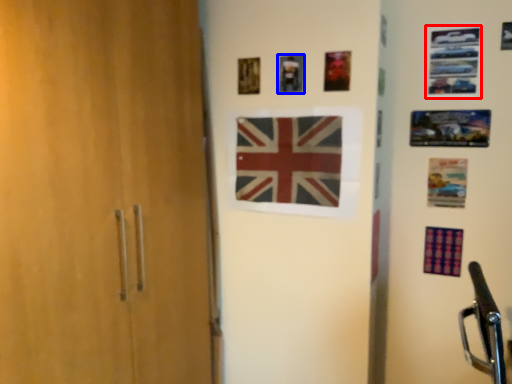
Question: Which object appears closest to the camera in this image, picture frame (highlighted by a red box) or picture frame (highlighted by a blue box)?

Choices:
 (A) picture frame
 (B) picture frame

Answer: (A)